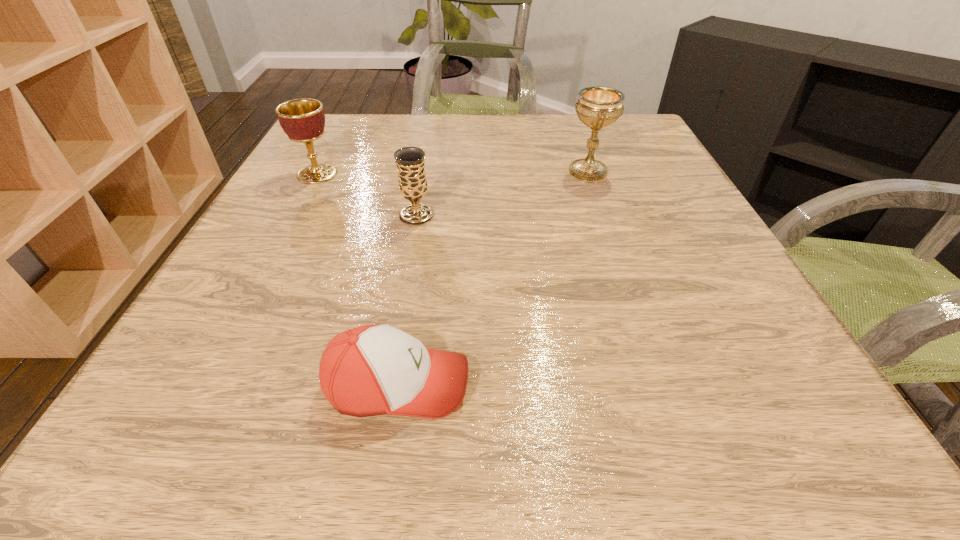
This screenshot has height=540, width=960. I want to click on object that stands as the third closest to the second chalice from left to right, so click(x=370, y=370).

Locate which chalice ranks third in proximity to the baseball cap. Please provide its 2D coordinates. Your answer should be formatted as a tuple, i.e. [(x, y)], where the tuple contains the x and y coordinates of a point satisfying the conditions above.

[(597, 107)]

Select which chalice is the closest to the rightmost object. Please provide its 2D coordinates. Your answer should be formatted as a tuple, i.e. [(x, y)], where the tuple contains the x and y coordinates of a point satisfying the conditions above.

[(410, 161)]